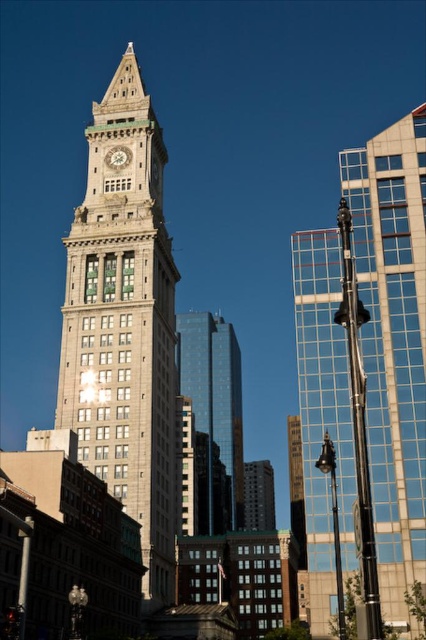
Question: Does polished glass tower at center come in front of light gray stone clock tower at center?

Choices:
 (A) no
 (B) yes

Answer: (B)

Question: Can you confirm if light gray stone clock tower at center is smaller than shiny glass skyscraper at center?

Choices:
 (A) no
 (B) yes

Answer: (A)

Question: Which point is closer to the camera?

Choices:
 (A) (388, 348)
 (B) (209, 384)
 (C) (118, 152)

Answer: (A)

Question: Does light gray stone clock tower at center come behind matte gray clock at center?

Choices:
 (A) yes
 (B) no

Answer: (B)

Question: Which object is positioned farthest from the matte gray clock at center?

Choices:
 (A) polished glass tower at center
 (B) light gray stone clock tower at center
 (C) shiny glass skyscraper at center

Answer: (C)

Question: Considering the real-world distances, which object is farthest from the matte gray clock at center?

Choices:
 (A) polished glass tower at center
 (B) shiny glass skyscraper at center
 (C) light gray stone clock tower at center

Answer: (B)